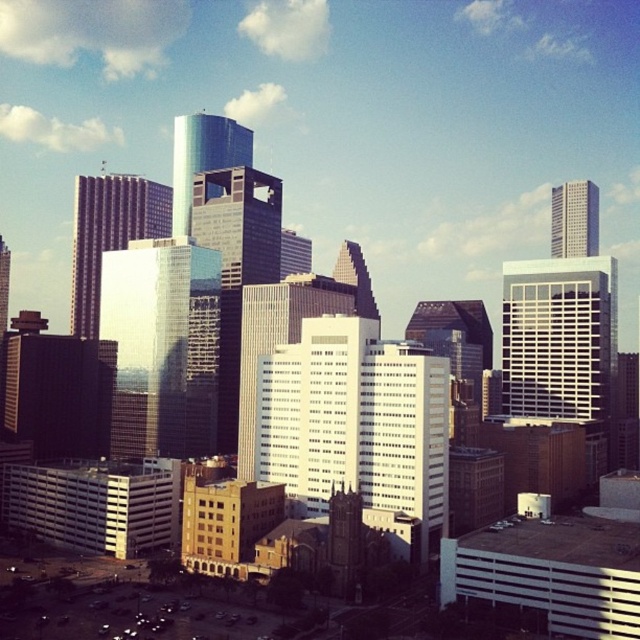
You are a city planner who needs to install a new streetlight between the reflective glass skyscraper at center and the shiny glass skyscraper at center. The streetlight requires a minimum of 30 meters of space between the two buildings to be placed safely. Can the streetlight be installed between them?

The reflective glass skyscraper at center and shiny glass skyscraper at center are 31.92 meters apart from each other. Since the required minimum space is 30 meters, the streetlight can be installed between them as the distance meets the requirement.